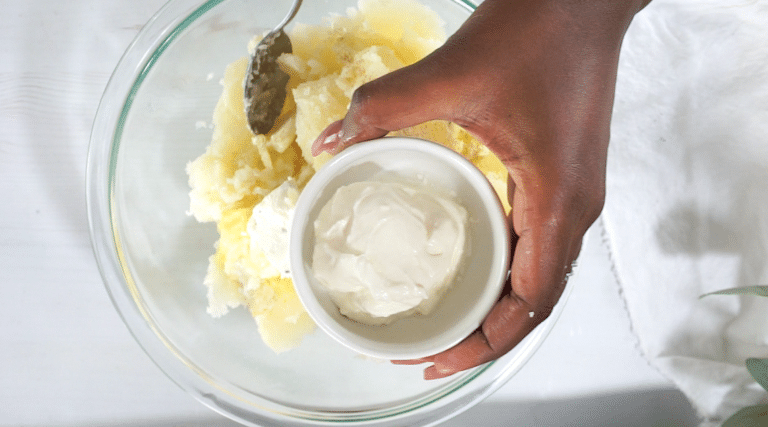
I want to click on cup, so click(378, 155).